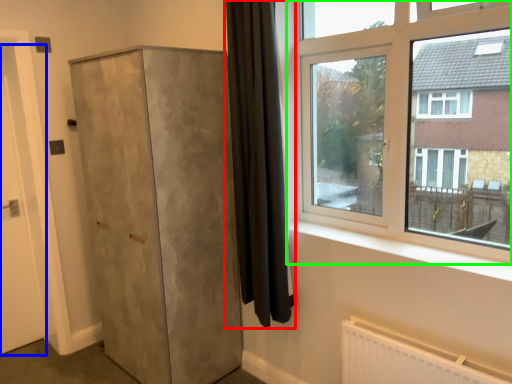
Question: Which object is positioned farthest from curtain (highlighted by a red box)? Select from door (highlighted by a blue box) and window (highlighted by a green box).

Choices:
 (A) door
 (B) window

Answer: (A)